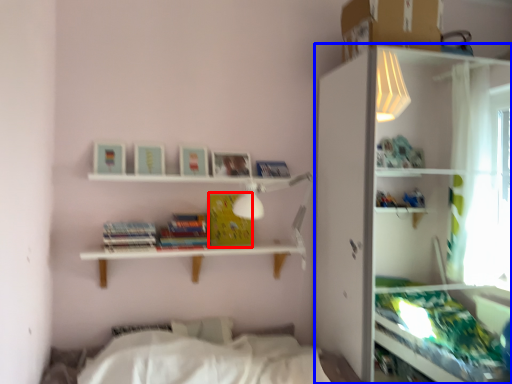
Question: Which point is further to the camera, paperback book (highlighted by a red box) or shelf (highlighted by a blue box)?

Choices:
 (A) paperback book
 (B) shelf

Answer: (A)